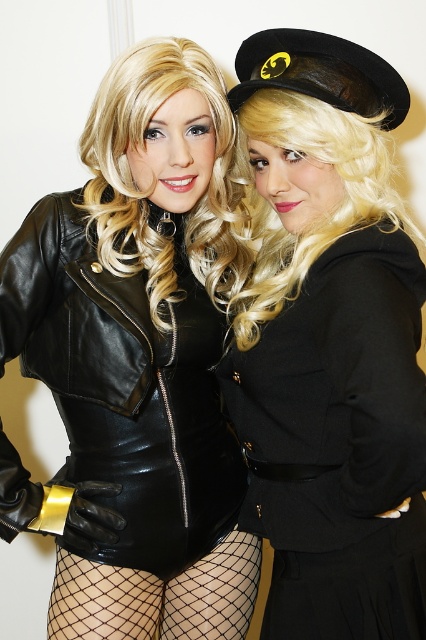
Can you confirm if matte black bodysuit at center is positioned above black woolen dress at center?

Yes.

Does matte black bodysuit at center have a lesser width compared to black woolen dress at center?

Incorrect, matte black bodysuit at center's width is not less than black woolen dress at center's.

Measure the distance between matte black bodysuit at center and camera.

matte black bodysuit at center and camera are 3.56 feet apart.

This screenshot has width=426, height=640. Find the location of `matte black bodysuit at center`. matte black bodysuit at center is located at coordinates (137, 362).